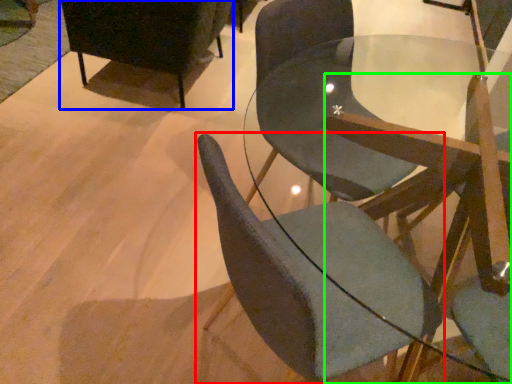
Question: Which is nearer to the chair (highlighted by a red box)? chair (highlighted by a blue box) or chair (highlighted by a green box).

Choices:
 (A) chair
 (B) chair

Answer: (B)